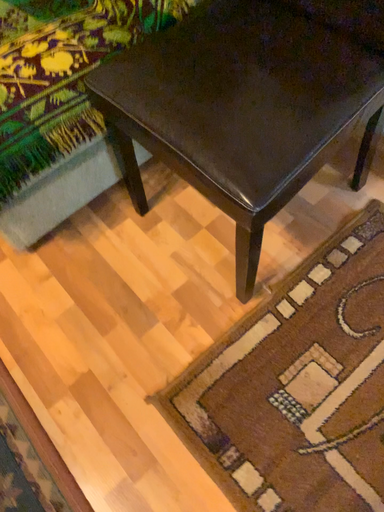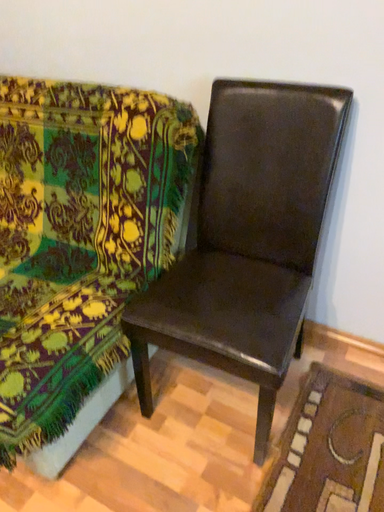
Question: How did the camera likely rotate when shooting the video?

Choices:
 (A) rotated downward
 (B) rotated upward

Answer: (B)